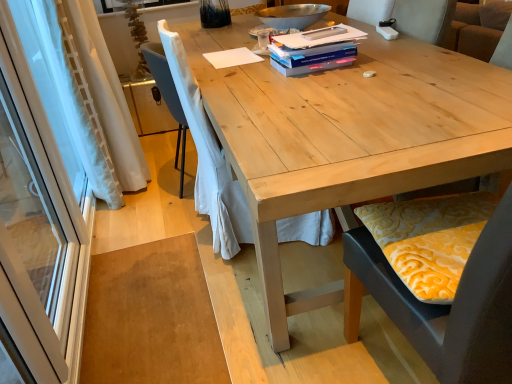
Image resolution: width=512 pixels, height=384 pixels. Find the location of `white fabric chair at center, the 2th chair from the right`. white fabric chair at center, the 2th chair from the right is located at coordinates (208, 158).

Measure the distance between point (332, 14) and camera.

2.44 meters.

In order to face blue matte paperback book at center, which is the 1th paperback book in bottom-to-top order, should I rotate leftwards or rightwards?

Rotate right and turn 7.778 degrees.

This screenshot has width=512, height=384. What do you see at coordinates (106, 95) in the screenshot?
I see `white sheer curtain at left, the second curtain in the front-to-back sequence` at bounding box center [106, 95].

Describe the element at coordinates (320, 37) in the screenshot. This screenshot has width=512, height=384. I see `blue matte paperback book at upper center, acting as the third paperback book starting from the bottom` at that location.

At what (x,y) coordinates should I click in order to perform the action: click on white fabric chair at center, which appears as the 2th chair when viewed from the front. Please return your answer as a coordinate pair (x, y). Looking at the image, I should click on (208, 158).

In the scene shown: How different are the orientations of white sheer curtain at left, the second curtain in the front-to-back sequence, and white fabric chair at center, which is counted as the first chair, starting from the left, in degrees?

1.73 degrees.

Is white sheer curtain at left, the 1th curtain viewed from the back, located outside white fabric chair at center, which appears as the 2th chair when viewed from the front?

Yes, white sheer curtain at left, the 1th curtain viewed from the back, is located beyond the bounds of white fabric chair at center, which appears as the 2th chair when viewed from the front.

In the scene shown: Could you measure the distance between white sheer curtain at left, the second curtain in the front-to-back sequence, and white fabric chair at center, which appears as the 2th chair when viewed from the front?

white sheer curtain at left, the second curtain in the front-to-back sequence, is 66.26 centimeters away from white fabric chair at center, which appears as the 2th chair when viewed from the front.

Which of these two, white sheer curtain at left, the second curtain in the front-to-back sequence, or white fabric chair at center, which is counted as the first chair, starting from the left, stands taller?

Standing taller between the two is white sheer curtain at left, the second curtain in the front-to-back sequence.

From a real-world perspective, is blue matte paperback book at upper center, the 2th paperback book ordered from the bottom, physically above blue matte paperback book at center, which is the 1th paperback book in bottom-to-top order?

Correct, in the physical world, blue matte paperback book at upper center, the 2th paperback book ordered from the bottom, is higher than blue matte paperback book at center, which is the 1th paperback book in bottom-to-top order.

Based on the photo, considering the sizes of objects blue matte paperback book at upper center, the 2th paperback book ordered from the bottom, and blue matte paperback book at center, which is the third paperback book from top to bottom, in the image provided, who is thinner, blue matte paperback book at upper center, the 2th paperback book ordered from the bottom, or blue matte paperback book at center, which is the third paperback book from top to bottom,?

blue matte paperback book at center, which is the third paperback book from top to bottom, is thinner.

Which is more to the left, blue matte paperback book at upper center, the 2th paperback book ordered from the bottom, or blue matte paperback book at center, which is the 1th paperback book in bottom-to-top order?

From the viewer's perspective, blue matte paperback book at center, which is the 1th paperback book in bottom-to-top order, appears more on the left side.

Does point (287, 66) appear closer or farther from the camera than point (311, 61)?

Point (287, 66) appears to be farther away from the viewer than point (311, 61).

In the scene shown: Considering the relative sizes of blue matte paperback book at center, which is the third paperback book from top to bottom, and white plastic remote control at upper center in the image provided, is blue matte paperback book at center, which is the third paperback book from top to bottom, wider than white plastic remote control at upper center?

Indeed, blue matte paperback book at center, which is the third paperback book from top to bottom, has a greater width compared to white plastic remote control at upper center.

Identify the location of remote control that appears behind the blue matte paperback book at center, which is the 1th paperback book in bottom-to-top order. This screenshot has width=512, height=384. (324, 32).

Is blue matte paperback book at center, which is the 1th paperback book in bottom-to-top order, taller or shorter than white plastic remote control at upper center?

Clearly, blue matte paperback book at center, which is the 1th paperback book in bottom-to-top order, is shorter compared to white plastic remote control at upper center.

Does blue matte paperback book at center, which is the third paperback book from top to bottom, touch white plastic remote control at upper center?

No, blue matte paperback book at center, which is the third paperback book from top to bottom, is not touching white plastic remote control at upper center.

Which chair is the 1st one when counting from the right side of the transparent glass screen door at left? Please provide its 2D coordinates.

[(208, 158)]

Is white fabric chair at center, the 2th chair from the right, positioned far away from transparent glass screen door at left?

white fabric chair at center, the 2th chair from the right, is near transparent glass screen door at left, not far away.

Is white fabric chair at center, which appears as the 2th chair when viewed from the front, oriented away from transparent glass screen door at left?

Yes, white fabric chair at center, which appears as the 2th chair when viewed from the front, is facing away from transparent glass screen door at left.

Between point (197, 148) and point (2, 207), which one is positioned in front?

The point (197, 148) is in front.

From the image's perspective, is yellow patterned cushion at lower right, arranged as the 1th chair when viewed from the front, below blue matte paperback book at upper center, acting as the third paperback book starting from the bottom?

Yes, from the image's perspective, yellow patterned cushion at lower right, arranged as the 1th chair when viewed from the front, is beneath blue matte paperback book at upper center, acting as the third paperback book starting from the bottom.

Measure the distance from yellow patterned cushion at lower right, which ranks as the first chair in right-to-left order, to blue matte paperback book at upper center, acting as the third paperback book starting from the bottom.

A distance of 36.19 inches exists between yellow patterned cushion at lower right, which ranks as the first chair in right-to-left order, and blue matte paperback book at upper center, acting as the third paperback book starting from the bottom.

Is yellow patterned cushion at lower right, marked as the 2th chair in a left-to-right arrangement, oriented towards blue matte paperback book at upper center, acting as the third paperback book starting from the bottom?

No, yellow patterned cushion at lower right, marked as the 2th chair in a left-to-right arrangement, is not aimed at blue matte paperback book at upper center, acting as the third paperback book starting from the bottom.

How many degrees apart are the facing directions of yellow patterned cushion at lower right, arranged as the 1th chair when viewed from the front, and blue matte paperback book at upper center, acting as the third paperback book starting from the bottom?

The angle between the facing direction of yellow patterned cushion at lower right, arranged as the 1th chair when viewed from the front, and the facing direction of blue matte paperback book at upper center, acting as the third paperback book starting from the bottom, is 99.4 degrees.

Considering the relative sizes of blue matte paperback book at center, which is the 1th paperback book in bottom-to-top order, and white fabric chair at center, the 2th chair from the right, in the image provided, is blue matte paperback book at center, which is the 1th paperback book in bottom-to-top order, thinner than white fabric chair at center, the 2th chair from the right,?

Yes, blue matte paperback book at center, which is the 1th paperback book in bottom-to-top order, is thinner than white fabric chair at center, the 2th chair from the right.

How distant is blue matte paperback book at center, which is the third paperback book from top to bottom, from white fabric chair at center, the 2th chair from the right?

blue matte paperback book at center, which is the third paperback book from top to bottom, and white fabric chair at center, the 2th chair from the right, are 22.16 inches apart.

Identify the location of paperback book that is the 1st one when counting rightward from the white fabric chair at center, placed as the 1th chair when sorted from back to front. (314, 57).

From a real-world perspective, which is physically below, blue matte paperback book at center, which is the third paperback book from top to bottom, or white fabric chair at center, the 2th chair from the right?

white fabric chair at center, the 2th chair from the right.

Is white sheer curtain at left, the second curtain in the front-to-back sequence, with blue matte paperback book at upper center, the 1th paperback book from the top?

white sheer curtain at left, the second curtain in the front-to-back sequence, is not next to blue matte paperback book at upper center, the 1th paperback book from the top, and they're not touching.

Can you confirm if white sheer curtain at left, the second curtain in the front-to-back sequence, is bigger than blue matte paperback book at upper center, acting as the third paperback book starting from the bottom?

Yes.

In the scene shown: Is white sheer curtain at left, the second curtain in the front-to-back sequence, spatially inside blue matte paperback book at upper center, the 1th paperback book from the top, or outside of it?

white sheer curtain at left, the second curtain in the front-to-back sequence, cannot be found inside blue matte paperback book at upper center, the 1th paperback book from the top.

Is white sheer curtain at left, the 1th curtain viewed from the back, to the right of blue matte paperback book at upper center, acting as the third paperback book starting from the bottom, from the viewer's perspective?

No.

Identify the location of the 2nd chair below the white sheer curtain at left, the 1th curtain viewed from the back (from a real-world perspective). (208, 158).

Locate an element on the screen. The width and height of the screenshot is (512, 384). the 1st paperback book positioned above the blue matte paperback book at center, which is the third paperback book from top to bottom (from the image's perspective) is located at coordinates (314, 52).

When comparing their distances from white plastic remote control at upper center, does blue matte paperback book at upper center, which is the second paperback book in top-to-bottom order, or metallic silver bowl at upper center seem further?

Based on the image, metallic silver bowl at upper center appears to be further to white plastic remote control at upper center.

Which object lies further to the anchor point white fabric chair at center, placed as the 1th chair when sorted from back to front, blue matte paperback book at upper center, acting as the third paperback book starting from the bottom, or blue matte paperback book at upper center, the 2th paperback book ordered from the bottom?

blue matte paperback book at upper center, acting as the third paperback book starting from the bottom.

When comparing their distances from blue matte paperback book at upper center, acting as the third paperback book starting from the bottom, does blue matte paperback book at upper center, the 2th paperback book ordered from the bottom, or transparent glass screen door at left seem further?

The object further to blue matte paperback book at upper center, acting as the third paperback book starting from the bottom, is transparent glass screen door at left.

Based on their spatial positions, is white plastic remote control at upper center or blue matte paperback book at upper center, the 1th paperback book from the top, closer to blue matte paperback book at center, which is the 1th paperback book in bottom-to-top order?

blue matte paperback book at upper center, the 1th paperback book from the top, is positioned closer to the anchor blue matte paperback book at center, which is the 1th paperback book in bottom-to-top order.

Based on their spatial positions, is white fabric chair at center, which is counted as the first chair, starting from the left, or natural wood table at center further from blue matte paperback book at center, which is the third paperback book from top to bottom?

Based on the image, white fabric chair at center, which is counted as the first chair, starting from the left, appears to be further to blue matte paperback book at center, which is the third paperback book from top to bottom.

Which object lies nearer to the anchor point yellow patterned cushion at lower right, marked as the 2th chair in a left-to-right arrangement, blue matte paperback book at upper center, acting as the third paperback book starting from the bottom, or transparent glass screen door at left?

Based on the image, blue matte paperback book at upper center, acting as the third paperback book starting from the bottom, appears to be nearer to yellow patterned cushion at lower right, marked as the 2th chair in a left-to-right arrangement.

From the image, which object appears to be farther from white fabric chair at center, placed as the 1th chair when sorted from back to front, yellow patterned cushion at lower right, arranged as the 1th chair when viewed from the front, or blue matte paperback book at center, which is the third paperback book from top to bottom?

Among the two, yellow patterned cushion at lower right, arranged as the 1th chair when viewed from the front, is located further to white fabric chair at center, placed as the 1th chair when sorted from back to front.

When comparing their distances from natural wood table at center, does white sheer curtain at left, the 1th curtain viewed from the back, or transparent glass screen door at left seem closer?

Among the two, transparent glass screen door at left is located nearer to natural wood table at center.

The height and width of the screenshot is (384, 512). What are the coordinates of `chair situated between white sheer curtain at left, the 1th curtain viewed from the back, and blue matte paperback book at upper center, the 1th paperback book from the top, from left to right` in the screenshot? It's located at (208, 158).

Identify the location of desk between transparent glass screen door at left and yellow patterned cushion at lower right, the 2th chair in the back-to-front sequence. (346, 136).

Find the location of a particular element. remote control between blue matte paperback book at center, which is the third paperback book from top to bottom, and metallic silver bowl at upper center in the front-back direction is located at coordinates (324, 32).

The height and width of the screenshot is (384, 512). Find the location of `paperback book between blue matte paperback book at upper center, which is the second paperback book in top-to-bottom order, and white fabric chair at center, the 2th chair from the right, from top to bottom`. paperback book between blue matte paperback book at upper center, which is the second paperback book in top-to-bottom order, and white fabric chair at center, the 2th chair from the right, from top to bottom is located at coordinates (314, 57).